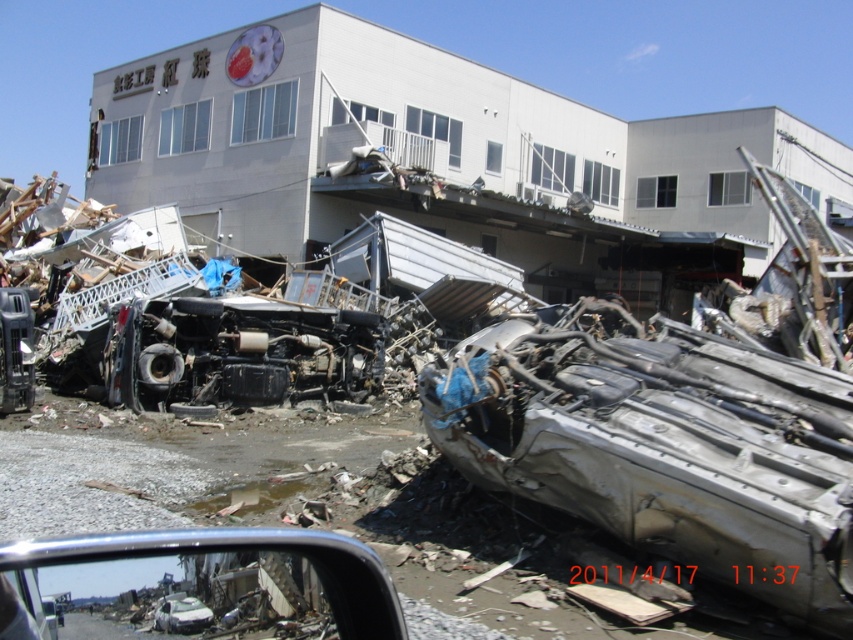
You are a rescue worker assessing the damage in this area. You see a rusty metallic car at center and a silver metallic car at center. Which car has a larger width?

The rusty metallic car at center has a larger width than the silver metallic car at center according to the description.

You are a rescue worker trying to navigate through the disaster area. You need to reach a survivor located at point (164,608). There is a dangerous debris field between you and point (788,502). Which point should you avoid stepping on to stay safe?

You should avoid stepping on point (788,502) because it is further away from you and the debris field is between you and that point, making it more dangerous to navigate.